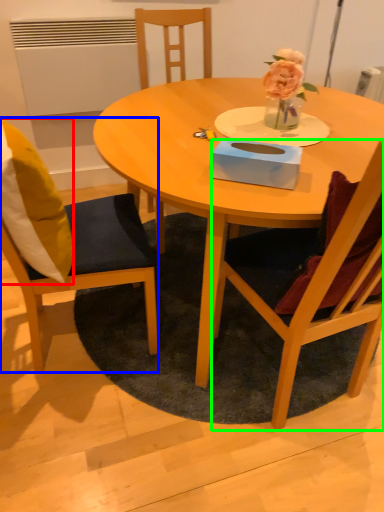
Question: Which is farther away from pillow (highlighted by a red box)? chair (highlighted by a blue box) or chair (highlighted by a green box)?

Choices:
 (A) chair
 (B) chair

Answer: (B)